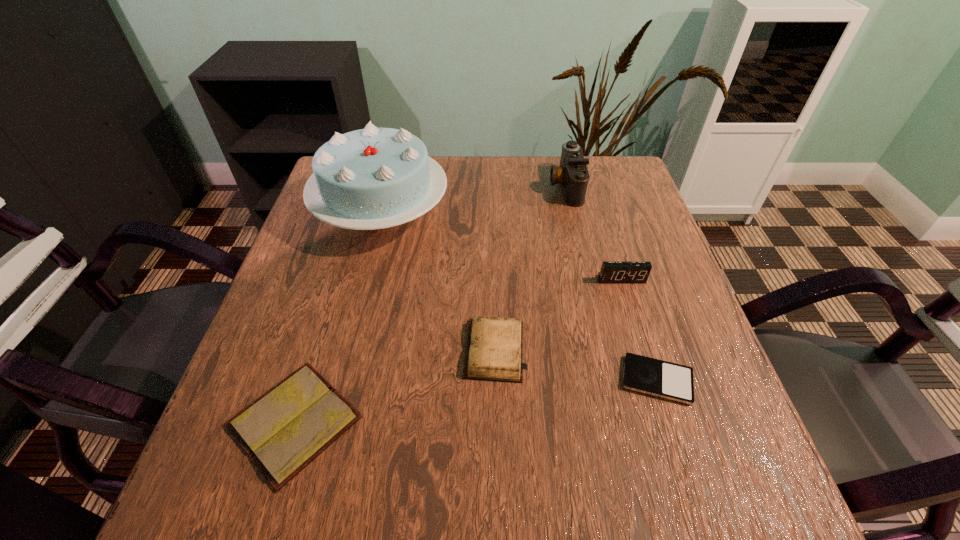
Image resolution: width=960 pixels, height=540 pixels. In order to click on vacant space at the right edge of the desktop in this screenshot , I will do `click(678, 360)`.

In the image, there is a desktop. Where is `free space at the near left corner`? free space at the near left corner is located at coordinates (214, 496).

Find the location of a particular element. free space between the left diary and the taller diary is located at coordinates (395, 386).

Find the location of a particular element. unoccupied position between the left diary and the camera is located at coordinates (430, 304).

Where is `free area in between the third farthest object and the camera`? The height and width of the screenshot is (540, 960). free area in between the third farthest object and the camera is located at coordinates (593, 233).

I want to click on vacant region between the shortest object and the fourth tallest object, so click(576, 365).

Locate an element on the screen. The height and width of the screenshot is (540, 960). blank region between the fifth tallest object and the second tallest object is located at coordinates (430, 304).

At what (x,y) coordinates should I click in order to perform the action: click on vacant space that is in between the fifth tallest object and the shortest object. Please return your answer as a coordinate pair (x, y). The image size is (960, 540). Looking at the image, I should click on (476, 401).

Image resolution: width=960 pixels, height=540 pixels. I want to click on free space between the birthday cake and the fifth shortest object, so click(474, 200).

The image size is (960, 540). Find the location of `vacant space that is in between the second shortest object and the iPod`. vacant space that is in between the second shortest object and the iPod is located at coordinates (476, 401).